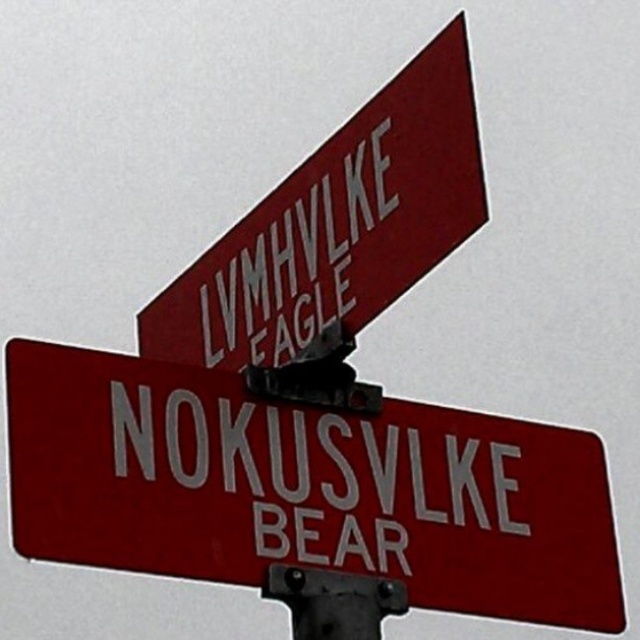
Who is more forward, (152,570) or (342,150)?

Point (152,570) is more forward.

Is smooth red sign at center behind white plastic sign at upper center?

No, it is not.

What do you see at coordinates (305, 488) in the screenshot? I see `smooth red sign at center` at bounding box center [305, 488].

Identify the location of smooth red sign at center. (305, 488).

Measure the distance between white glossy street sign at center and black metal pole at center.

6.07 inches

Is white glossy street sign at center bigger than black metal pole at center?

Indeed, white glossy street sign at center has a larger size compared to black metal pole at center.

Is point (400, 518) farther from viewer compared to point (352, 592)?

Yes, point (400, 518) is behind point (352, 592).

In order to click on white glossy street sign at center in this screenshot , I will do pos(316,476).

Is smooth red sign at center bigger than white glossy street sign at center?

Yes.

Can you confirm if smooth red sign at center is positioned to the right of white glossy street sign at center?

Correct, you'll find smooth red sign at center to the right of white glossy street sign at center.

Image resolution: width=640 pixels, height=640 pixels. In order to click on smooth red sign at center in this screenshot , I will do `click(305, 488)`.

Where is `smooth red sign at center`? smooth red sign at center is located at coordinates (305, 488).